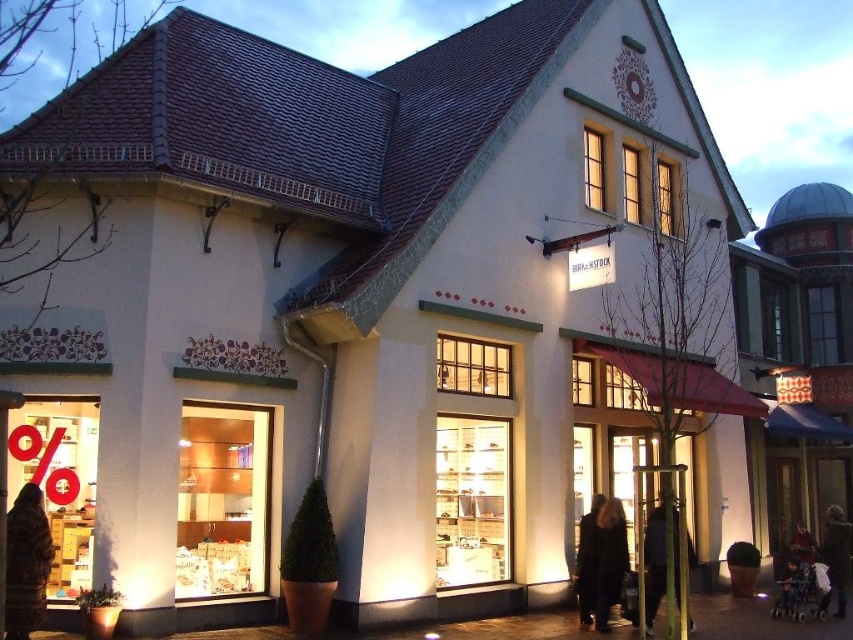
You are standing in front of the storefront and want to touch both points labeled as point (653, 573) and point (613, 545). Which point will you reach first?

Point (653, 573) is closer to the camera than point (613, 545), so you will reach point (653, 573) first.

You are standing outside the store and want to check the price tag of the dark gray fabric coat at center. Considering the distance, can you read the price tag clearly from where you are?

The dark gray fabric coat at center is 138.06 feet away from the camera, so it is too far to read the price tag clearly from that distance.